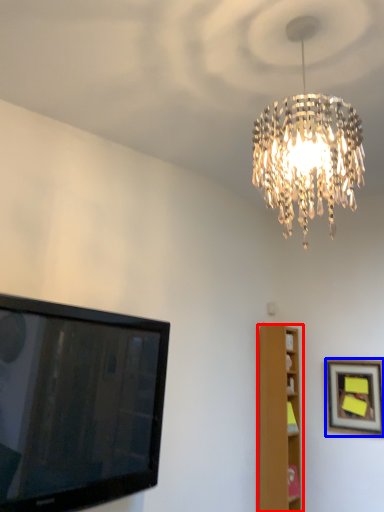
Question: Which of the following is the farthest to the observer, furniture (highlighted by a red box) or picture frame (highlighted by a blue box)?

Choices:
 (A) furniture
 (B) picture frame

Answer: (A)